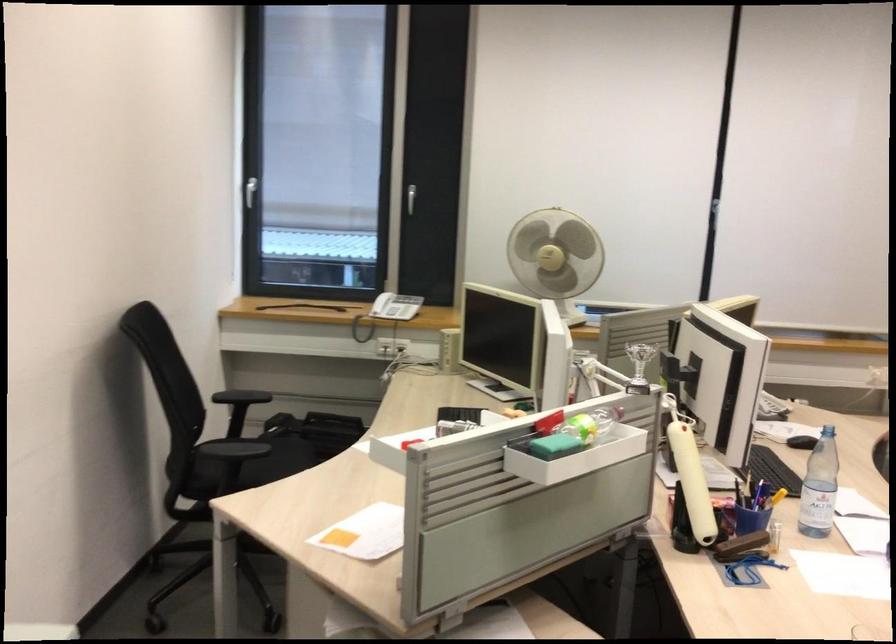
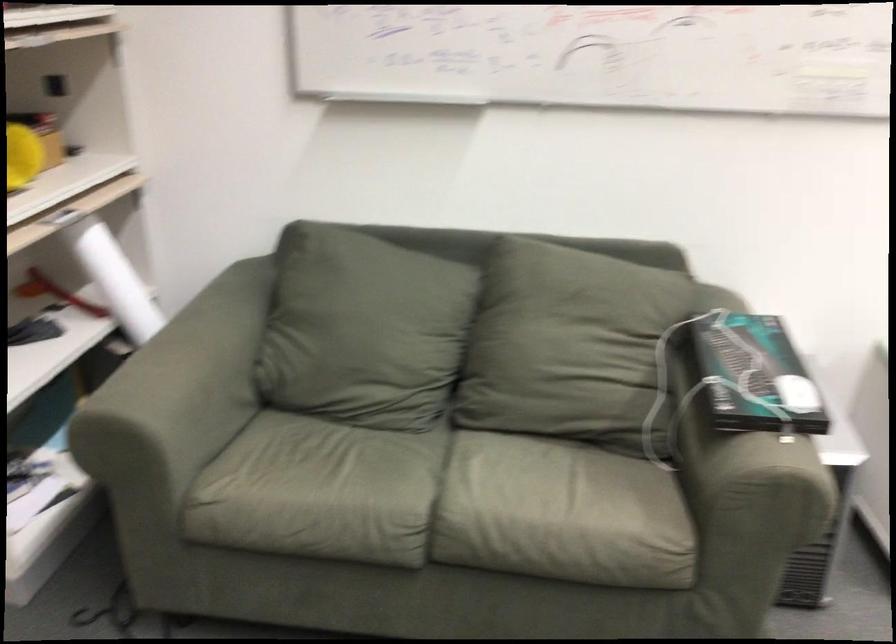
The images are taken continuously from a first-person perspective. In which direction is your viewpoint rotating?

The camera's rotation is toward left-down.